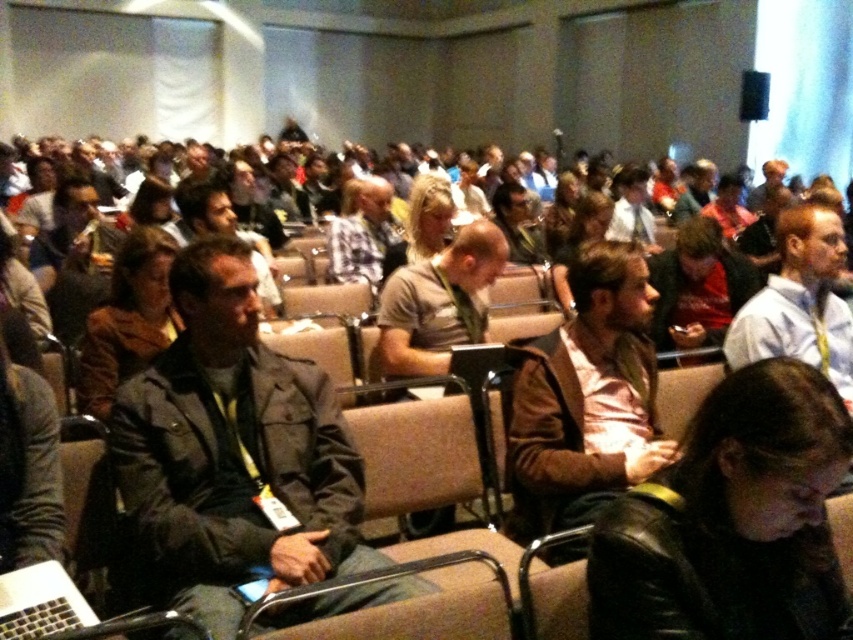
From the picture: You are sitting in the front row of the audience and want to borrow a pen from the person wearing the dark gray jacket at center. Since you can only look forward and not behind you, can you see the person wearing the black leather jacket at lower right?

The dark gray jacket at center is located above the black leather jacket at lower right. Since you are sitting in the front row and can only look forward, you would be facing away from the black leather jacket at lower right, so you cannot see it.

You are an event organizer who needs to arrange a photo shoot for the attendees. You notice the dark gray jacket at center and the black leather jacket at lower right. Which jacket should you ask the attendee to adjust their position so that both jackets are visible in the photo?

The dark gray jacket at center is taller than the black leather jacket at lower right. To ensure both are visible, the attendee wearing the dark gray jacket at center should move slightly back or to the side so it doesn not block the view of the shorter black leather jacket at lower right.

You are sitting in the audience and notice two people in front of you. One is wearing a black leather jacket at lower right and the other is wearing a red shirt at center. Which person is positioned to the left of the other?

The black leather jacket at lower right is to the left of the red shirt at center.